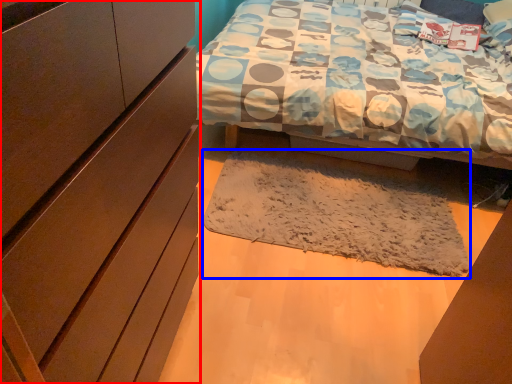
Question: Among these objects, which one is nearest to the camera, cabinetry (highlighted by a red box) or mat (highlighted by a blue box)?

Choices:
 (A) cabinetry
 (B) mat

Answer: (A)